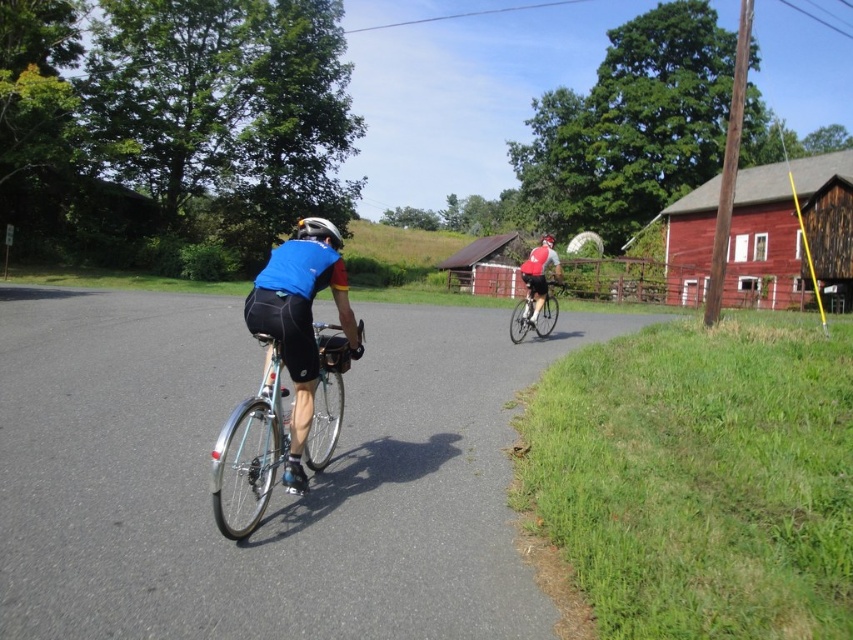
Which is behind, point (538, 314) or point (550, 244)?

The point (538, 314) is behind.

Is point (543, 317) farther from viewer compared to point (547, 240)?

Yes, point (543, 317) is behind point (547, 240).

You are a GUI agent. You are given a task and a screenshot of the screen. Output one action in this format:
    pyautogui.click(x=<x>, y=<y>)
    Task: Click on the shiny silver bicycle at right
    Image resolution: width=853 pixels, height=640 pixels.
    Given the screenshot: What is the action you would take?
    pyautogui.click(x=532, y=312)

Does matte blue jersey at center have a greater width compared to matte red jersey at center?

Incorrect, matte blue jersey at center's width does not surpass matte red jersey at center's.

Between point (306, 419) and point (548, 252), which one is positioned behind?

The point (548, 252) is more distant.

The image size is (853, 640). What are the coordinates of `matte blue jersey at center` in the screenshot? It's located at (300, 321).

Can you confirm if silver metallic bicycle at center is positioned below white matte bicycle helmet at center?

Yes.

Between silver metallic bicycle at center and white matte bicycle helmet at center, which one appears on the right side from the viewer's perspective?

From the viewer's perspective, silver metallic bicycle at center appears more on the right side.

Is point (242, 536) farther from viewer compared to point (314, 228)?

No.

Locate an element on the screen. silver metallic bicycle at center is located at coordinates (253, 452).